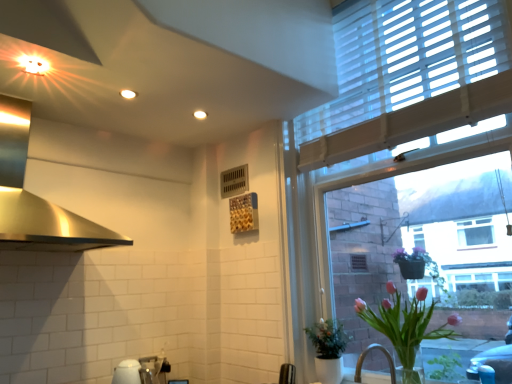
Question: From a real-world perspective, is white glossy sink at lower center on top of green matte plant at lower right, arranged as the first houseplant when viewed from the back?

Choices:
 (A) yes
 (B) no

Answer: (B)

Question: Does white glossy sink at lower center have a larger size compared to green matte plant at lower right, arranged as the first houseplant when viewed from the back?

Choices:
 (A) no
 (B) yes

Answer: (A)

Question: Is white glossy sink at lower center not within green matte plant at lower right, arranged as the first houseplant when viewed from the back?

Choices:
 (A) yes
 (B) no

Answer: (A)

Question: From the image's perspective, would you say white glossy sink at lower center is shown under green matte plant at lower right, the 2th houseplant viewed from the front?

Choices:
 (A) yes
 (B) no

Answer: (A)

Question: Does white glossy sink at lower center have a greater width compared to green matte plant at lower right, arranged as the first houseplant when viewed from the back?

Choices:
 (A) no
 (B) yes

Answer: (A)

Question: Is the position of white glossy sink at lower center more distant than that of green matte plant at lower right, arranged as the first houseplant when viewed from the back?

Choices:
 (A) no
 (B) yes

Answer: (B)

Question: Is white textured window at upper right surrounding polished stainless steel exhaust hood at upper left?

Choices:
 (A) no
 (B) yes

Answer: (A)

Question: From the image's perspective, does white textured window at upper right appear lower than polished stainless steel exhaust hood at upper left?

Choices:
 (A) yes
 (B) no

Answer: (B)

Question: Is white textured window at upper right next to polished stainless steel exhaust hood at upper left?

Choices:
 (A) no
 (B) yes

Answer: (A)

Question: Is white textured window at upper right taller than polished stainless steel exhaust hood at upper left?

Choices:
 (A) yes
 (B) no

Answer: (A)

Question: Is white textured window at upper right facing away from polished stainless steel exhaust hood at upper left?

Choices:
 (A) yes
 (B) no

Answer: (B)

Question: Does white textured window at upper right have a smaller size compared to polished stainless steel exhaust hood at upper left?

Choices:
 (A) no
 (B) yes

Answer: (A)

Question: Does white glossy sink at lower center appear on the right side of polished stainless steel exhaust hood at upper left?

Choices:
 (A) yes
 (B) no

Answer: (A)